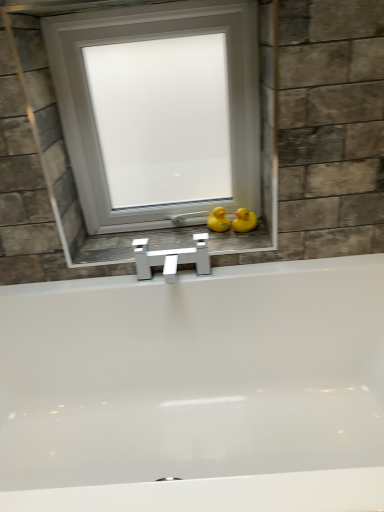
Measure the distance between white glossy faucet at center and camera.

They are 1.30 meters apart.

You are a GUI agent. You are given a task and a screenshot of the screen. Output one action in this format:
    pyautogui.click(x=<x>, y=<y>)
    Task: Click on the yellow rubber duck at right, the first duck when ordered from right to left
    This screenshot has height=512, width=384.
    Given the screenshot: What is the action you would take?
    pyautogui.click(x=244, y=221)

Measure the distance between yellow rubber duck at right, acting as the second duck starting from the left, and camera.

The distance of yellow rubber duck at right, acting as the second duck starting from the left, from camera is 1.41 meters.

Based on the photo, what is the approximate width of yellow rubber duck at center, the first duck in the left-to-right sequence?

yellow rubber duck at center, the first duck in the left-to-right sequence, is 3.74 inches in width.

Identify the location of white glossy faucet at center. The height and width of the screenshot is (512, 384). (169, 244).

Which of these two, white matte window at center or yellow rubber duck at right, the first duck when ordered from right to left, is wider?

white matte window at center.

From a real-world perspective, is white matte window at center physically located above or below yellow rubber duck at right, acting as the second duck starting from the left?

From a real-world perspective, white matte window at center is physically above yellow rubber duck at right, acting as the second duck starting from the left.

From the image's perspective, is white matte window at center located above or below yellow rubber duck at right, acting as the second duck starting from the left?

white matte window at center is situated higher than yellow rubber duck at right, acting as the second duck starting from the left, in the image.

Does white matte window at center have a smaller size compared to yellow rubber duck at right, the first duck when ordered from right to left?

Actually, white matte window at center might be larger than yellow rubber duck at right, the first duck when ordered from right to left.

Considering the sizes of objects white matte window at center and yellow rubber duck at center, the first duck in the left-to-right sequence, in the image provided, who is wider, white matte window at center or yellow rubber duck at center, the first duck in the left-to-right sequence,?

Wider between the two is white matte window at center.

Considering the relative positions of white matte window at center and yellow rubber duck at center, the first duck in the left-to-right sequence, in the image provided, is white matte window at center to the left or to the right of yellow rubber duck at center, the first duck in the left-to-right sequence,?

Based on their positions, white matte window at center is located to the left of yellow rubber duck at center, the first duck in the left-to-right sequence.

Is the depth of white matte window at center greater than that of yellow rubber duck at center, which is the 2th duck in right-to-left order?

No, it is in front of yellow rubber duck at center, which is the 2th duck in right-to-left order.

Is white matte window at center looking in the opposite direction of yellow rubber duck at center, which is the 2th duck in right-to-left order?

No.

From the image's perspective, relative to white matte window at center, is yellow rubber duck at center, which is the 2th duck in right-to-left order, above or below?

yellow rubber duck at center, which is the 2th duck in right-to-left order, is situated lower than white matte window at center in the image.

Could you tell me if yellow rubber duck at center, which is the 2th duck in right-to-left order, is facing white matte window at center?

No, yellow rubber duck at center, which is the 2th duck in right-to-left order, is not aimed at white matte window at center.

Which is behind, point (218, 218) or point (78, 52)?

The point (218, 218) is farther from the camera.

Is yellow rubber duck at center, the first duck in the left-to-right sequence, inside or outside of white matte window at center?

yellow rubber duck at center, the first duck in the left-to-right sequence, lies within the bounds of white matte window at center.

Is point (253, 217) positioned before point (223, 216)?

No, it is behind (223, 216).

Which object is more forward, yellow rubber duck at right, acting as the second duck starting from the left, or yellow rubber duck at center, the first duck in the left-to-right sequence?

yellow rubber duck at right, acting as the second duck starting from the left, is in front.

Considering the sizes of objects yellow rubber duck at right, the first duck when ordered from right to left, and yellow rubber duck at center, the first duck in the left-to-right sequence, in the image provided, who is taller, yellow rubber duck at right, the first duck when ordered from right to left, or yellow rubber duck at center, the first duck in the left-to-right sequence,?

yellow rubber duck at center, the first duck in the left-to-right sequence.

Is white glossy faucet at center taller than white matte window at center?

In fact, white glossy faucet at center may be shorter than white matte window at center.

Is white glossy faucet at center far away from white matte window at center?

No, white glossy faucet at center is not far from white matte window at center.

From a real-world perspective, who is located lower, white glossy faucet at center or white matte window at center?

In real-world perspective, white glossy faucet at center is lower.

In terms of height, does white glossy faucet at center look taller or shorter compared to yellow rubber duck at center, which is the 2th duck in right-to-left order?

In the image, white glossy faucet at center appears to be shorter than yellow rubber duck at center, which is the 2th duck in right-to-left order.

Measure the distance between white glossy faucet at center and yellow rubber duck at center, the first duck in the left-to-right sequence.

white glossy faucet at center is 7.36 inches away from yellow rubber duck at center, the first duck in the left-to-right sequence.

Is white glossy faucet at center with yellow rubber duck at center, the first duck in the left-to-right sequence?

No, white glossy faucet at center is not with yellow rubber duck at center, the first duck in the left-to-right sequence.

From a real-world perspective, between white glossy faucet at center and yellow rubber duck at center, which is the 2th duck in right-to-left order, who is vertically lower?

white glossy faucet at center is physically lower.

Is yellow rubber duck at right, the first duck when ordered from right to left, far from white matte window at center?

That's not correct — yellow rubber duck at right, the first duck when ordered from right to left, is a little close to white matte window at center.

Considering the sizes of objects yellow rubber duck at right, the first duck when ordered from right to left, and white matte window at center in the image provided, who is shorter, yellow rubber duck at right, the first duck when ordered from right to left, or white matte window at center?

yellow rubber duck at right, the first duck when ordered from right to left.

Based on the photo, from a real-world perspective, is yellow rubber duck at right, the first duck when ordered from right to left, positioned above or below white matte window at center?

In terms of real-world spatial position, yellow rubber duck at right, the first duck when ordered from right to left, is below white matte window at center.

Is yellow rubber duck at right, the first duck when ordered from right to left, surrounding white matte window at center?

No, white matte window at center is not inside yellow rubber duck at right, the first duck when ordered from right to left.

At what (x,y) coordinates should I click in order to perform the action: click on window above the yellow rubber duck at right, the first duck when ordered from right to left (from a real-world perspective). Please return your answer as a coordinate pair (x, y). The width and height of the screenshot is (384, 512). Looking at the image, I should click on click(156, 160).

This screenshot has width=384, height=512. Find the location of `the 2nd duck directly beneath the white matte window at center (from a real-world perspective)`. the 2nd duck directly beneath the white matte window at center (from a real-world perspective) is located at coordinates (218, 220).

When comparing their distances from yellow rubber duck at center, the first duck in the left-to-right sequence, does white matte window at center or white glossy faucet at center seem closer?

The object closer to yellow rubber duck at center, the first duck in the left-to-right sequence, is white glossy faucet at center.

Estimate the real-world distances between objects in this image. Which object is closer to yellow rubber duck at right, acting as the second duck starting from the left, white glossy faucet at center or white matte window at center?

white glossy faucet at center is closer to yellow rubber duck at right, acting as the second duck starting from the left.

Based on the photo, estimate the real-world distances between objects in this image. Which object is further from white glossy faucet at center, yellow rubber duck at right, acting as the second duck starting from the left, or yellow rubber duck at center, the first duck in the left-to-right sequence?

Based on the image, yellow rubber duck at right, acting as the second duck starting from the left, appears to be further to white glossy faucet at center.

Looking at the image, which one is located further to white glossy faucet at center, yellow rubber duck at right, the first duck when ordered from right to left, or white matte window at center?

white matte window at center is further to white glossy faucet at center.

Consider the image. Looking at the image, which one is located closer to white matte window at center, white glossy faucet at center or yellow rubber duck at center, the first duck in the left-to-right sequence?

white glossy faucet at center.

Based on the photo, estimate the real-world distances between objects in this image. Which object is further from yellow rubber duck at right, the first duck when ordered from right to left, white glossy faucet at center or yellow rubber duck at center, which is the 2th duck in right-to-left order?

The object further to yellow rubber duck at right, the first duck when ordered from right to left, is white glossy faucet at center.

Based on the photo, considering their positions, is yellow rubber duck at center, which is the 2th duck in right-to-left order, positioned further to white glossy faucet at center than white matte window at center?

Among the two, white matte window at center is located further to white glossy faucet at center.

From the image, which object appears to be nearer to white glossy faucet at center, white matte window at center or yellow rubber duck at center, the first duck in the left-to-right sequence?

The object closer to white glossy faucet at center is yellow rubber duck at center, the first duck in the left-to-right sequence.

Locate an element on the screen. duck situated between white glossy faucet at center and yellow rubber duck at right, the first duck when ordered from right to left, from left to right is located at coordinates (218, 220).

I want to click on duck between white matte window at center and yellow rubber duck at right, acting as the second duck starting from the left, in the up-down direction, so click(218, 220).